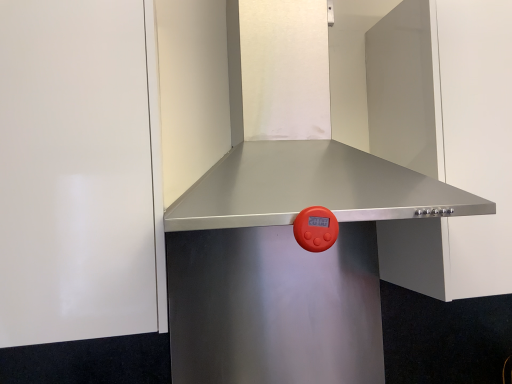
Question: Is the surface of stainless steel range hood at upper center, the 1th door viewed from the right, in direct contact with stainless steel vent at center?

Choices:
 (A) no
 (B) yes

Answer: (A)

Question: Does stainless steel range hood at upper center, placed as the second door when sorted from left to right, have a greater height compared to stainless steel vent at center?

Choices:
 (A) yes
 (B) no

Answer: (A)

Question: Is stainless steel range hood at upper center, the 1th door viewed from the right, at the left side of stainless steel vent at center?

Choices:
 (A) yes
 (B) no

Answer: (B)

Question: Is stainless steel vent at center completely or partially inside stainless steel range hood at upper center, placed as the second door when sorted from left to right?

Choices:
 (A) yes
 (B) no

Answer: (B)

Question: Could you tell me if stainless steel range hood at upper center, placed as the second door when sorted from left to right, is facing stainless steel vent at center?

Choices:
 (A) no
 (B) yes

Answer: (A)

Question: Is point click(390, 69) closer or farther from the camera than point click(5, 196)?

Choices:
 (A) farther
 (B) closer

Answer: (A)

Question: Considering the positions of stainless steel range hood at upper center, the 1th door viewed from the right, and white glossy door at upper left, which appears as the 1th door when viewed from the left, in the image, is stainless steel range hood at upper center, the 1th door viewed from the right, wider or thinner than white glossy door at upper left, which appears as the 1th door when viewed from the left,?

Choices:
 (A) thin
 (B) wide

Answer: (B)

Question: Considering their positions, is stainless steel range hood at upper center, placed as the second door when sorted from left to right, located in front of or behind white glossy door at upper left, which appears as the 1th door when viewed from the left?

Choices:
 (A) behind
 (B) front

Answer: (A)

Question: Is stainless steel range hood at upper center, placed as the second door when sorted from left to right, bigger or smaller than white glossy door at upper left, which appears as the 1th door when viewed from the left?

Choices:
 (A) small
 (B) big

Answer: (B)

Question: Considering the positions of point (10, 140) and point (440, 284), is point (10, 140) closer or farther from the camera than point (440, 284)?

Choices:
 (A) closer
 (B) farther

Answer: (A)

Question: Relative to stainless steel range hood at upper center, placed as the second door when sorted from left to right, is white glossy door at upper left, which appears as the 1th door when viewed from the left, in front or behind?

Choices:
 (A) behind
 (B) front

Answer: (B)

Question: Considering the positions of white glossy door at upper left, the second door in the right-to-left sequence, and stainless steel range hood at upper center, placed as the second door when sorted from left to right, in the image, is white glossy door at upper left, the second door in the right-to-left sequence, wider or thinner than stainless steel range hood at upper center, placed as the second door when sorted from left to right,?

Choices:
 (A) thin
 (B) wide

Answer: (A)

Question: Is white glossy door at upper left, which appears as the 1th door when viewed from the left, taller or shorter than stainless steel range hood at upper center, the 1th door viewed from the right?

Choices:
 (A) short
 (B) tall

Answer: (B)

Question: Is stainless steel vent at center bigger or smaller than stainless steel range hood at upper center, placed as the second door when sorted from left to right?

Choices:
 (A) small
 (B) big

Answer: (B)

Question: From the image's perspective, is stainless steel vent at center positioned above or below stainless steel range hood at upper center, the 1th door viewed from the right?

Choices:
 (A) above
 (B) below

Answer: (A)